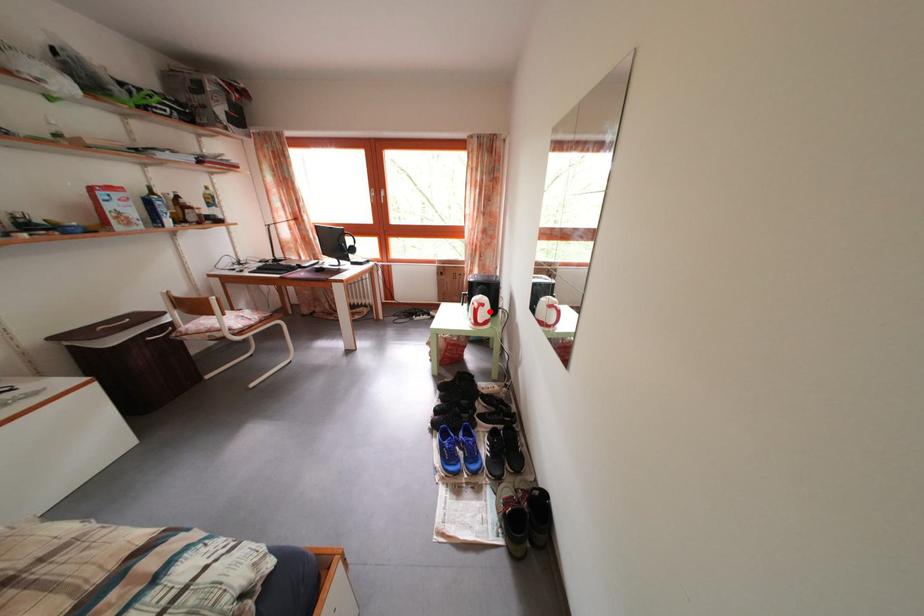
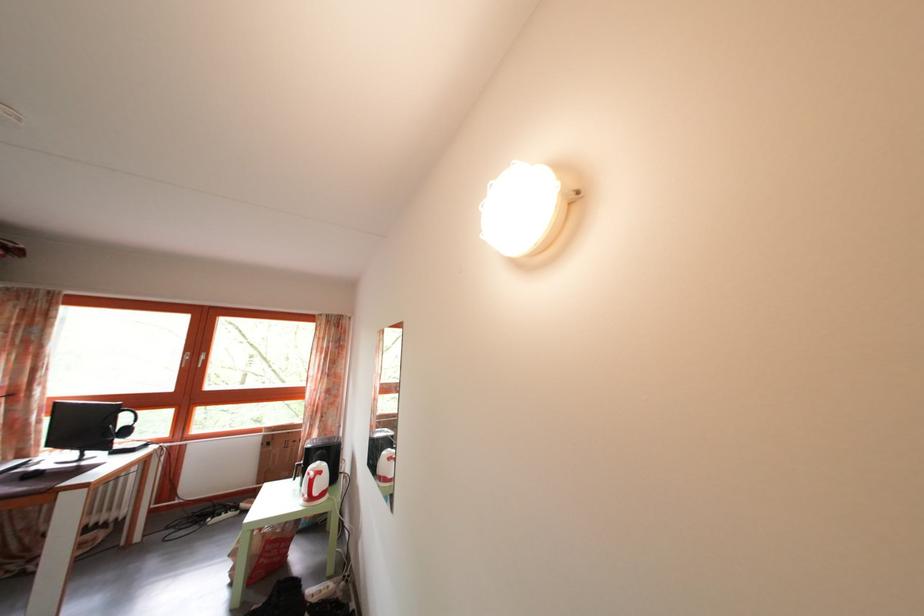
The point at the highlighted location is marked in the first image. Where is the corresponding point in the second image?

(327, 480)